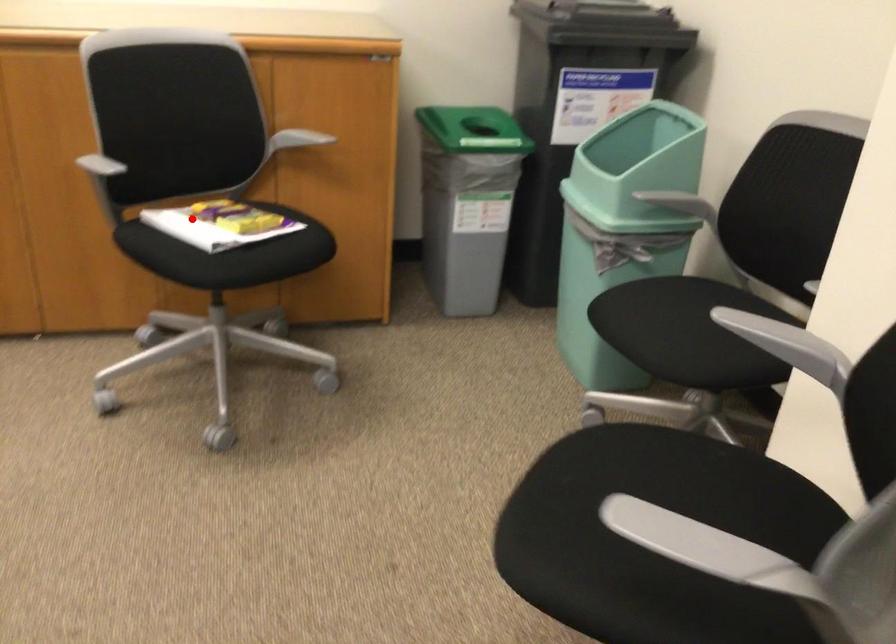
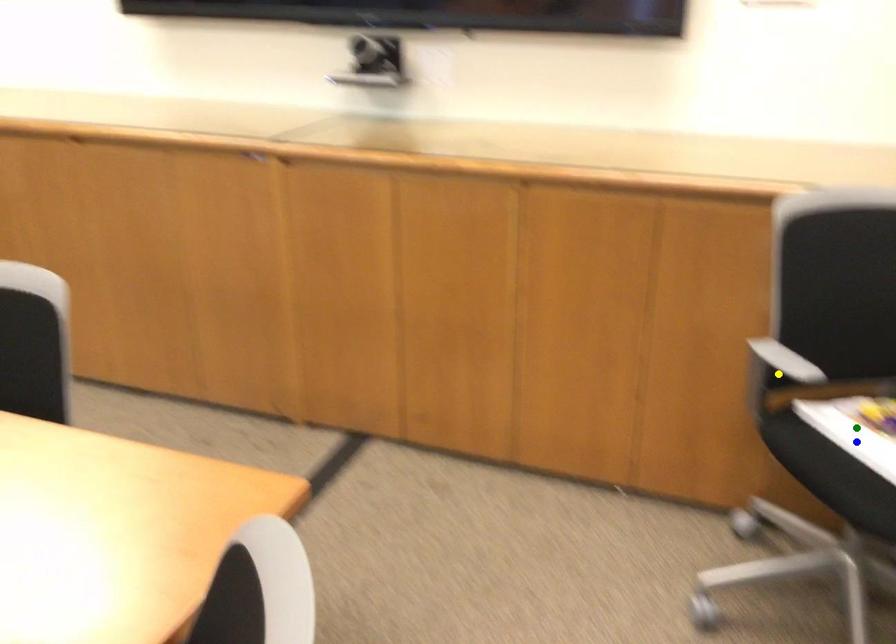
Question: I am providing you with two images of the same scene from different viewpoints. A red point is marked on the first image. You are given multiple points on the second image. Which point in image 2 represents the same 3d spot as the red point in image 1?

Choices:
 (A) yellow point
 (B) green point
 (C) blue point

Answer: (B)